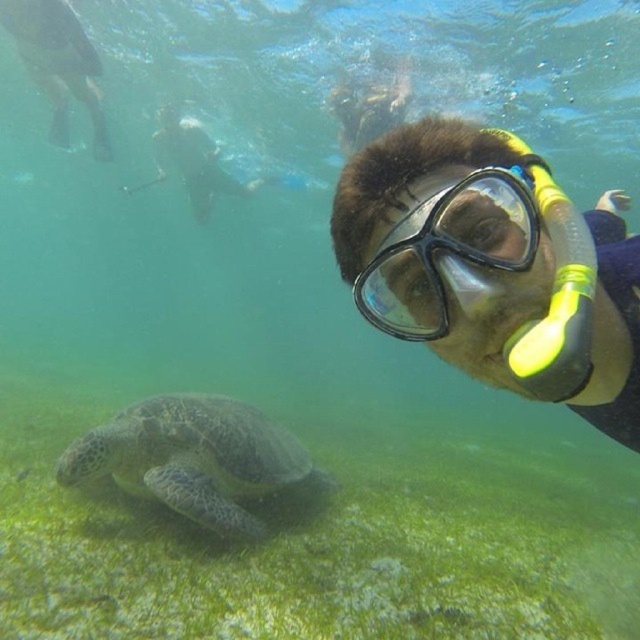
You are an underwater photographer aiming to capture a closeup of the clear plastic mask at center and the black matte scuba mask at upper right. Which mask should you focus on first to ensure it appears larger in your photo?

The clear plastic mask at center is closer to the viewer than the black matte scuba mask at upper right, so focusing on the clear plastic mask at center first will make it appear larger in the photo.

You are a marine biologist observing the underwater scene. You notice two masks in the image. Which mask is taller, the clear plastic mask at center or the black matte scuba mask at upper right?

The clear plastic mask at center is taller than the black matte scuba mask at upper right according to the description.

You are a photographer underwater and want to take a clear photo of both the point at (195, 394) and the point at (371, 284). Which point should you focus on first to ensure both are in focus?

You should focus on point (371, 284) first because it is closer to the camera than point (195, 394). By focusing on the closer point, the further point will also be in focus due to depth of field.